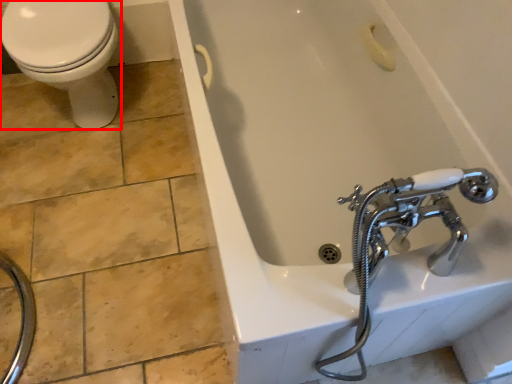
Question: From the image, what is the correct spatial relationship of bidet (annotated by the red box) in relation to bathtub?

Choices:
 (A) left
 (B) right

Answer: (A)